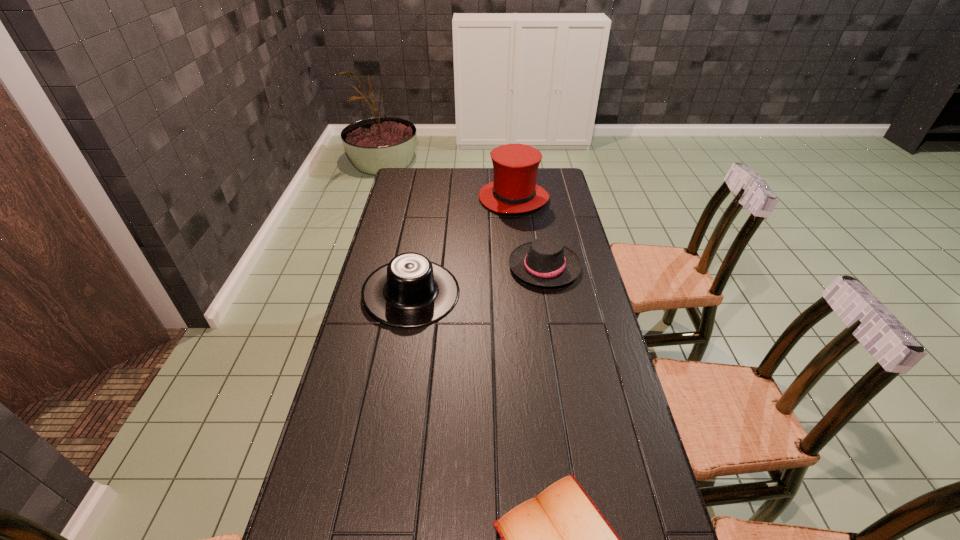
Where is `object that stands as the second closest to the tallest dress hat`? object that stands as the second closest to the tallest dress hat is located at coordinates tap(410, 291).

I want to click on the closest object to the shortest object, so click(410, 291).

Find the location of `the closest dress hat relative to the Bible`. the closest dress hat relative to the Bible is located at coordinates (410, 291).

The image size is (960, 540). Identify the location of the closest dress hat to the third shortest object. (546, 262).

Find the location of `vacant space that satisfies the following two spatial constraints: 1. on the back side of the shortest dress hat; 2. on the left side of the second shortest dress hat`. vacant space that satisfies the following two spatial constraints: 1. on the back side of the shortest dress hat; 2. on the left side of the second shortest dress hat is located at coordinates (416, 266).

You are a GUI agent. You are given a task and a screenshot of the screen. Output one action in this format:
    pyautogui.click(x=<x>, y=<y>)
    Task: Click on the free point that satisfies the following two spatial constraints: 1. on the back side of the leftmost object; 2. on the right side of the farthest object
    Image resolution: width=960 pixels, height=540 pixels.
    Given the screenshot: What is the action you would take?
    pyautogui.click(x=428, y=198)

Where is `blank space that satisfies the following two spatial constraints: 1. on the back side of the tallest dress hat; 2. on the right side of the leftmost object`? The width and height of the screenshot is (960, 540). blank space that satisfies the following two spatial constraints: 1. on the back side of the tallest dress hat; 2. on the right side of the leftmost object is located at coordinates (428, 198).